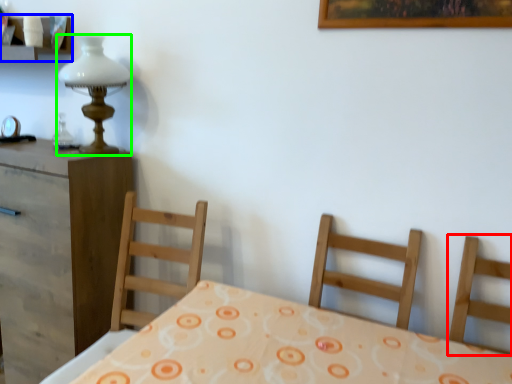
Question: Considering the real-world distances, which object is farthest from chair (highlighted by a red box)? shelf (highlighted by a blue box) or table lamp (highlighted by a green box)?

Choices:
 (A) shelf
 (B) table lamp

Answer: (A)